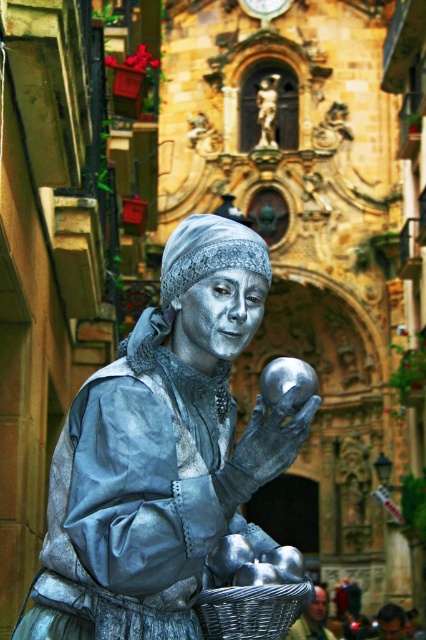
Who is shorter, shiny silver statue at center or metallic woven basket at lower center?

metallic woven basket at lower center is shorter.

Is the position of shiny silver statue at center less distant than that of metallic woven basket at lower center?

That is True.

Where is `shiny silver statue at center`? The image size is (426, 640). shiny silver statue at center is located at coordinates (163, 452).

Who is shorter, metallic woven basket at lower center or polished bronze statue at center?

With less height is polished bronze statue at center.

Does metallic woven basket at lower center appear on the left side of polished bronze statue at center?

Correct, you'll find metallic woven basket at lower center to the left of polished bronze statue at center.

Who is more distant from viewer, (265, 595) or (262, 124)?

Point (262, 124)

Where is `metallic woven basket at lower center`? metallic woven basket at lower center is located at coordinates (250, 611).

Is shiny silver statue at center to the right of polished bronze statue at center from the viewer's perspective?

In fact, shiny silver statue at center is to the left of polished bronze statue at center.

This screenshot has width=426, height=640. In order to click on shiny silver statue at center in this screenshot , I will do `click(163, 452)`.